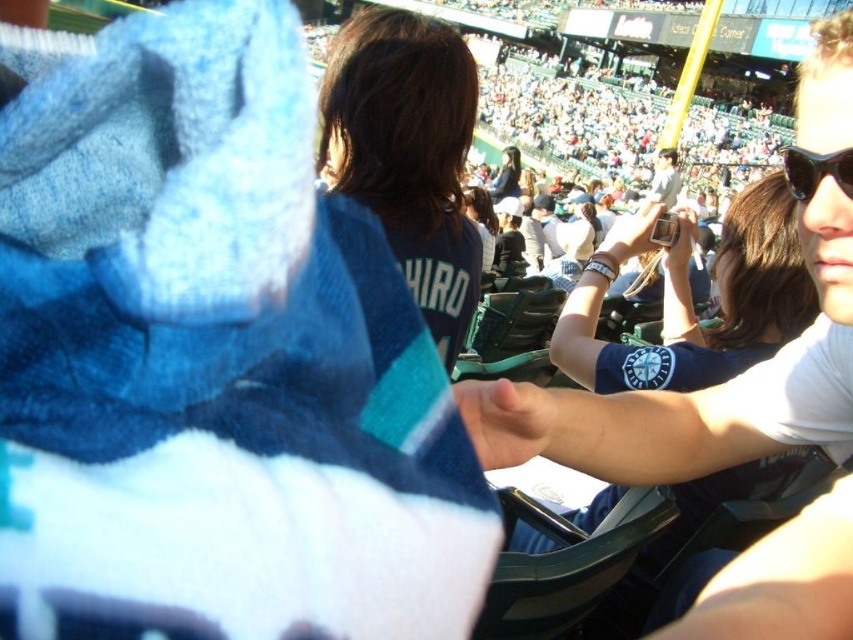
Can you confirm if white matte shirt at upper right is positioned below light gray shirt at upper center?

Yes, white matte shirt at upper right is below light gray shirt at upper center.

Is white matte shirt at upper right shorter than light gray shirt at upper center?

In fact, white matte shirt at upper right may be taller than light gray shirt at upper center.

Which is behind, point (775, 611) or point (666, 186)?

Positioned behind is point (666, 186).

Find the location of a particular element. This screenshot has height=640, width=853. white matte shirt at upper right is located at coordinates (695, 392).

Between point (842, 188) and point (494, 230), which one is positioned in front?

Point (842, 188) is in front.

Can you confirm if black plastic sunglasses at upper right is thinner than matte black jacket at center?

No, black plastic sunglasses at upper right is not thinner than matte black jacket at center.

This screenshot has height=640, width=853. What do you see at coordinates (815, 170) in the screenshot? I see `black plastic sunglasses at upper right` at bounding box center [815, 170].

This screenshot has height=640, width=853. What are the coordinates of `black plastic sunglasses at upper right` in the screenshot? It's located at tap(815, 170).

Can you confirm if matte black jacket at center is smaller than matte black jacket at upper center?

Indeed, matte black jacket at center has a smaller size compared to matte black jacket at upper center.

Is matte black jacket at center above matte black jacket at upper center?

Incorrect, matte black jacket at center is not positioned above matte black jacket at upper center.

Who is more forward, [463,209] or [503,157]?

Point [463,209]

You are a GUI agent. You are given a task and a screenshot of the screen. Output one action in this format:
    pyautogui.click(x=<x>, y=<y>)
    Task: Click on the matte black jacket at center
    
    Given the screenshot: What is the action you would take?
    point(480,220)